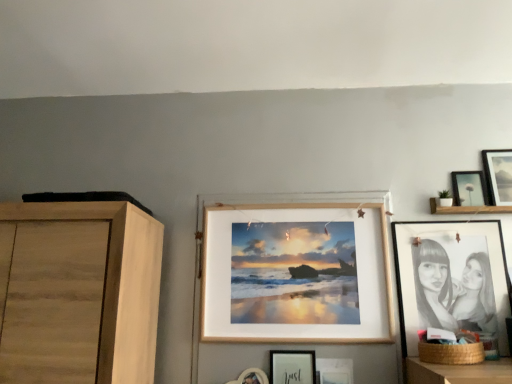
Question: In which direction should I rotate to look at matte wooden picture frame at center, marked as the fourth picture frame in a right-to-left arrangement?

Choices:
 (A) left
 (B) right

Answer: (B)

Question: From the image's perspective, is matte white picture frame at center, acting as the 1th picture frame starting from the left, over matte wooden picture frame at center, acting as the third picture frame starting from the left?

Choices:
 (A) yes
 (B) no

Answer: (A)

Question: Is matte white picture frame at center, which is the 6th picture frame from right to left, taller than matte wooden picture frame at center, acting as the third picture frame starting from the left?

Choices:
 (A) yes
 (B) no

Answer: (A)

Question: Would you say matte white picture frame at center, acting as the 1th picture frame starting from the left, is outside matte wooden picture frame at center, marked as the fourth picture frame in a right-to-left arrangement?

Choices:
 (A) yes
 (B) no

Answer: (A)

Question: Is matte white picture frame at center, which is the 6th picture frame from right to left, bigger than matte wooden picture frame at center, marked as the fourth picture frame in a right-to-left arrangement?

Choices:
 (A) yes
 (B) no

Answer: (A)

Question: From the image's perspective, is matte white picture frame at center, acting as the 1th picture frame starting from the left, below matte wooden picture frame at center, marked as the fourth picture frame in a right-to-left arrangement?

Choices:
 (A) yes
 (B) no

Answer: (B)

Question: Is matte white picture frame at center, acting as the 1th picture frame starting from the left, shorter than matte wooden picture frame at center, marked as the fourth picture frame in a right-to-left arrangement?

Choices:
 (A) no
 (B) yes

Answer: (A)

Question: Is wooden frame at center, positioned as the 5th picture frame in right-to-left order, positioned before matte black picture frame at upper right, the 2th picture frame positioned from the right?

Choices:
 (A) no
 (B) yes

Answer: (B)

Question: Considering the relative sizes of wooden frame at center, arranged as the 2th picture frame when viewed from the left, and matte black picture frame at upper right, which is the fifth picture frame from left to right, in the image provided, is wooden frame at center, arranged as the 2th picture frame when viewed from the left, shorter than matte black picture frame at upper right, which is the fifth picture frame from left to right,?

Choices:
 (A) yes
 (B) no

Answer: (B)

Question: Considering the relative sizes of wooden frame at center, positioned as the 5th picture frame in right-to-left order, and matte black picture frame at upper right, the 2th picture frame positioned from the right, in the image provided, is wooden frame at center, positioned as the 5th picture frame in right-to-left order, bigger than matte black picture frame at upper right, the 2th picture frame positioned from the right,?

Choices:
 (A) yes
 (B) no

Answer: (A)

Question: Is matte black picture frame at upper right, the 2th picture frame positioned from the right, completely or partially inside wooden frame at center, arranged as the 2th picture frame when viewed from the left?

Choices:
 (A) no
 (B) yes

Answer: (A)

Question: Does wooden frame at center, arranged as the 2th picture frame when viewed from the left, lie behind matte black picture frame at upper right, which is the fifth picture frame from left to right?

Choices:
 (A) no
 (B) yes

Answer: (A)

Question: Does wooden frame at center, positioned as the 5th picture frame in right-to-left order, have a greater width compared to matte black picture frame at upper right, the 2th picture frame positioned from the right?

Choices:
 (A) no
 (B) yes

Answer: (B)

Question: Can you confirm if matte black picture frame at upper right, which is the fifth picture frame from left to right, is shorter than wooden frame at center, positioned as the 5th picture frame in right-to-left order?

Choices:
 (A) no
 (B) yes

Answer: (B)